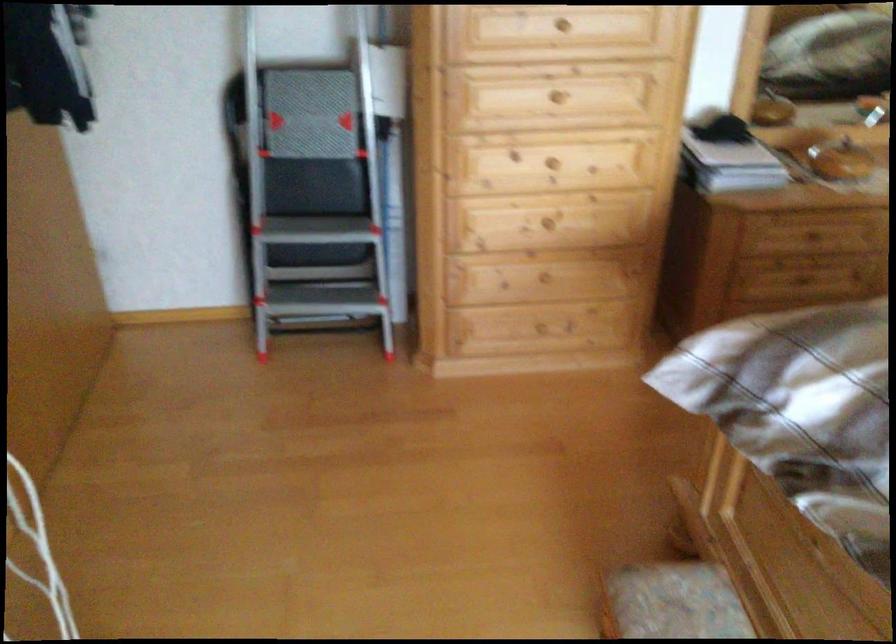
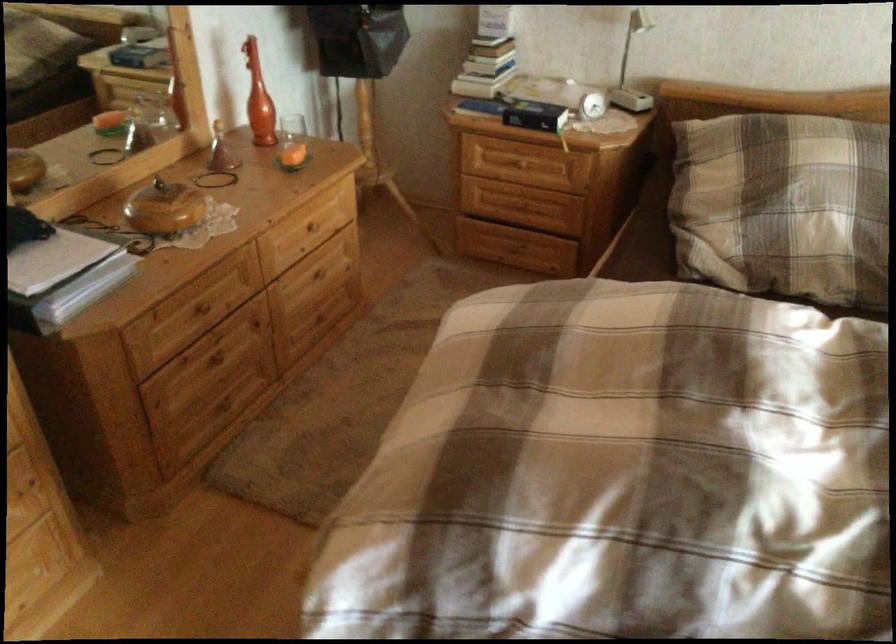
Question: Based on the continuous images, in which direction is the camera rotating? Reply with the corresponding letter.

Choices:
 (A) Left
 (B) Right
 (C) Up
 (D) Down

Answer: (B)